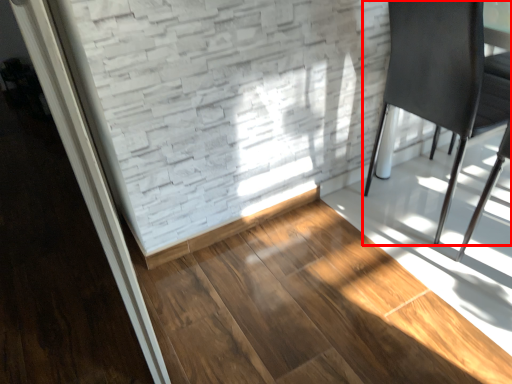
Question: From the image's perspective, where is chair (annotated by the red box) located relative to hardwood?

Choices:
 (A) above
 (B) below

Answer: (A)